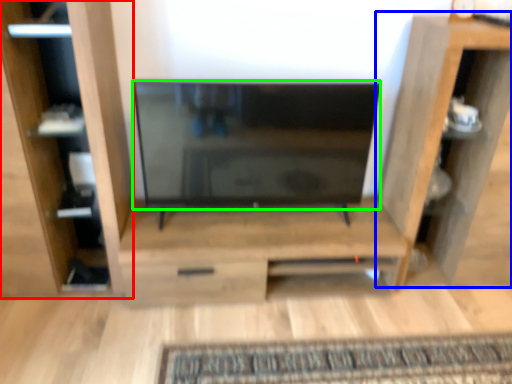
Question: Which is farther away from furniture (highlighted by a red box)? shelf (highlighted by a blue box) or screen (highlighted by a green box)?

Choices:
 (A) shelf
 (B) screen

Answer: (A)